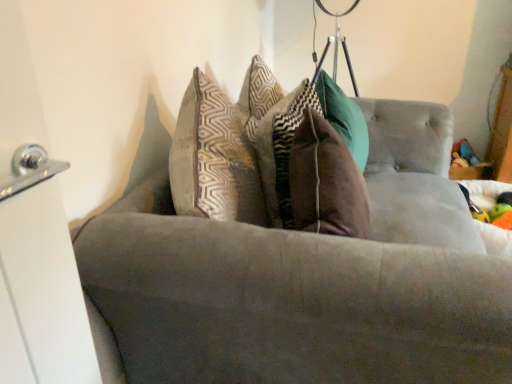
Describe the element at coordinates (298, 266) in the screenshot. I see `suede couch at center` at that location.

The image size is (512, 384). I want to click on suede couch at center, so click(298, 266).

Locate an element on the screen. The width and height of the screenshot is (512, 384). suede couch at center is located at coordinates (298, 266).